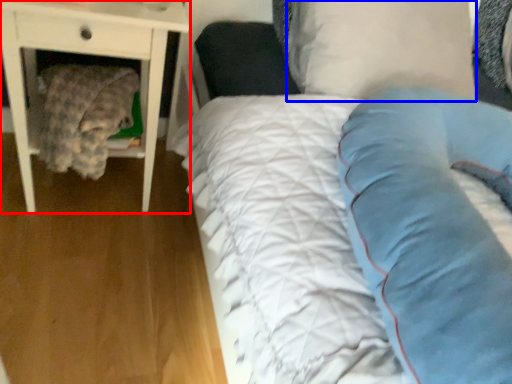
Question: Which of the following is the closest to the observer, nightstand (highlighted by a red box) or pillow (highlighted by a blue box)?

Choices:
 (A) nightstand
 (B) pillow

Answer: (B)